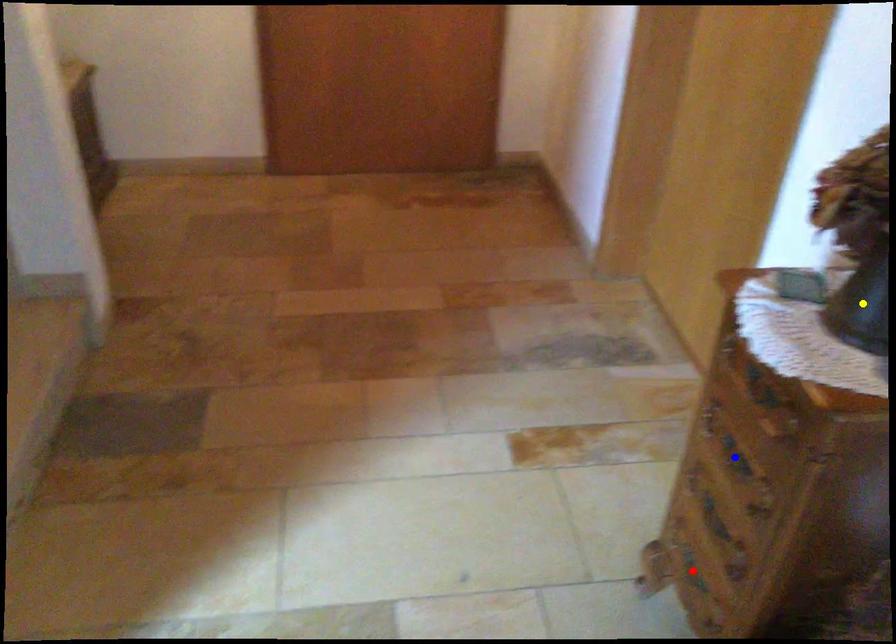
Order these from nearest to farthest:
- yellow point
- blue point
- red point

yellow point < blue point < red point